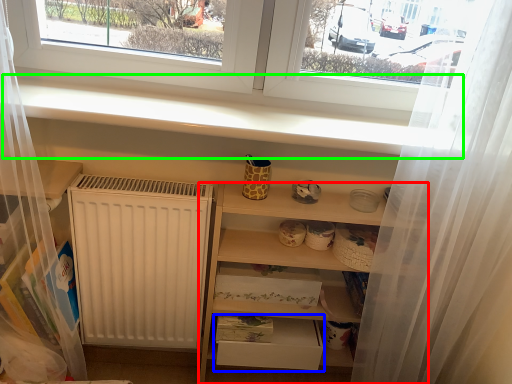
Question: Which is nearer to the shelf (highlighted by a red box)? drawer (highlighted by a blue box) or window sill (highlighted by a green box).

Choices:
 (A) drawer
 (B) window sill

Answer: (A)